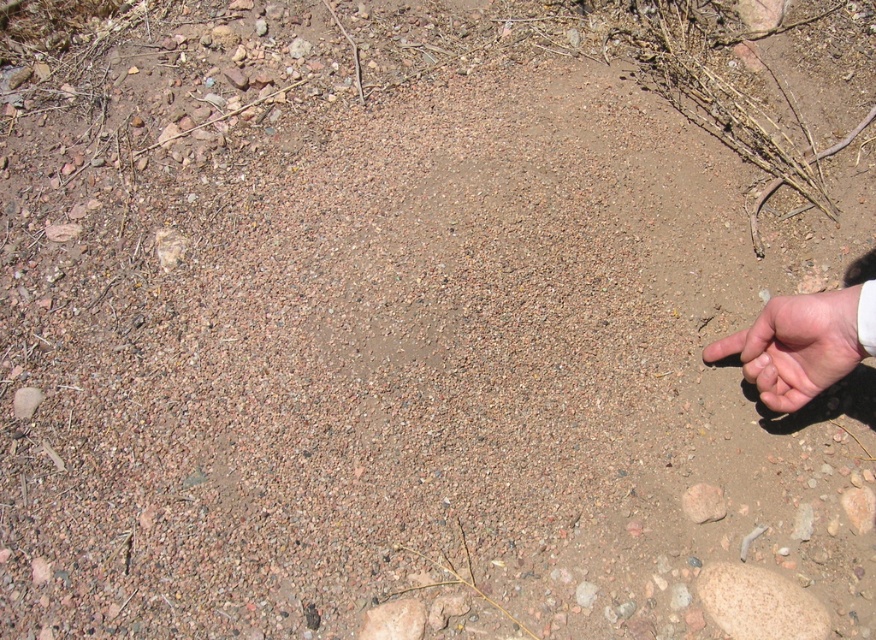
You are a photographer trying to capture the brown rough stone at center in your shot. There is a skinny white hand at lower right blocking part of the stone. Can you adjust your position so that the hand is no longer covering the stone?

The skinny white hand at lower right is taller than brown rough stone at center, so moving the camera upward might position the hand above the stone and avoid blocking it.

You are holding a small object and looking at the image. There is a skinny white hand at lower right and a brown rough stone at center. Which object is closer to you in the image?

The skinny white hand at lower right is closer to you because it is in front of the brown rough stone at center.

You are looking at the image of the ground with soil and stones. There is a point marked at coordinates (x=796, y=346). What object is located at this point?

At point (x=796, y=346) lies skinny white hand at lower right.